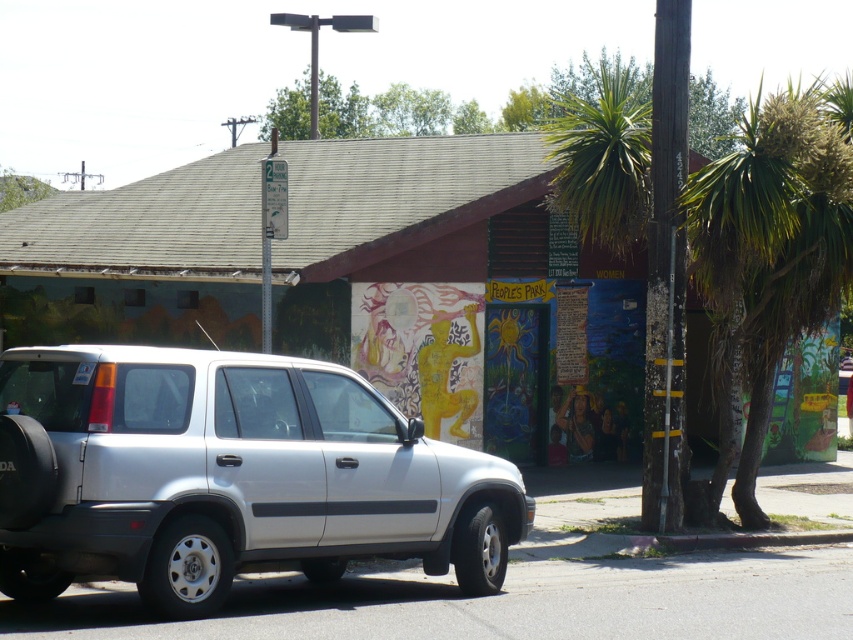
Is point (91, 474) closer to viewer compared to point (660, 460)?

Yes, it is.

Can you confirm if silver metallic suv at center is taller than wooden pole at right?

No.

Is point (25, 451) farther from camera compared to point (685, 176)?

That is False.

Locate an element on the screen. silver metallic suv at center is located at coordinates (228, 476).